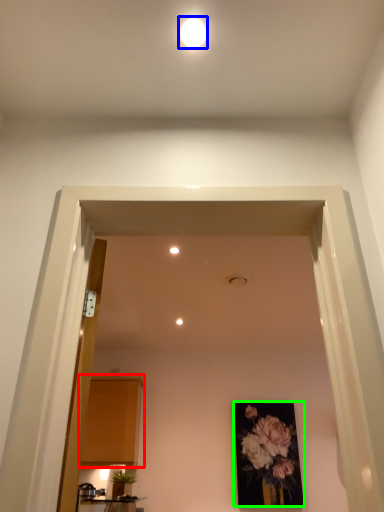
Question: Estimate the real-world distances between objects in this image. Which object is closer to cabinetry (highlighted by a red box), lighting (highlighted by a blue box) or picture frame (highlighted by a green box)?

Choices:
 (A) lighting
 (B) picture frame

Answer: (B)